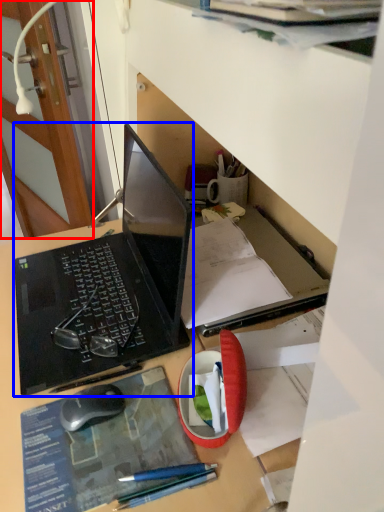
Question: Which point is closer to the camera, door (highlighted by a red box) or laptop (highlighted by a blue box)?

Choices:
 (A) door
 (B) laptop

Answer: (B)